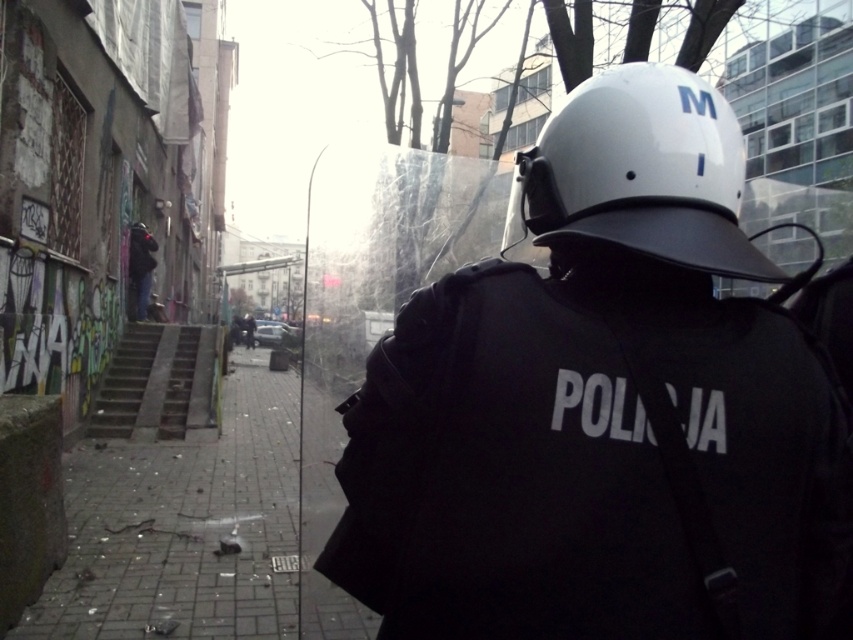
Who is more forward, (660, 561) or (189, 412)?

Point (660, 561) is in front.

Who is more distant from viewer, (x=779, y=342) or (x=186, y=337)?

The point (x=186, y=337) is more distant.

This screenshot has width=853, height=640. In order to click on white matte helmet at upper center in this screenshot , I will do `click(604, 406)`.

Looking at this image, is white matte helmet at upper center bigger than white matte helmet at center?

Indeed, white matte helmet at upper center has a larger size compared to white matte helmet at center.

Which is in front, point (590, 636) or point (614, 141)?

Positioned in front is point (590, 636).

This screenshot has height=640, width=853. In order to click on white matte helmet at upper center in this screenshot , I will do `click(604, 406)`.

Can you confirm if white matte helmet at center is positioned below concrete stairs at center?

No, white matte helmet at center is not below concrete stairs at center.

Which is above, white matte helmet at center or concrete stairs at center?

white matte helmet at center is higher up.

Image resolution: width=853 pixels, height=640 pixels. Describe the element at coordinates (641, 172) in the screenshot. I see `white matte helmet at center` at that location.

Identify the location of white matte helmet at center. (641, 172).